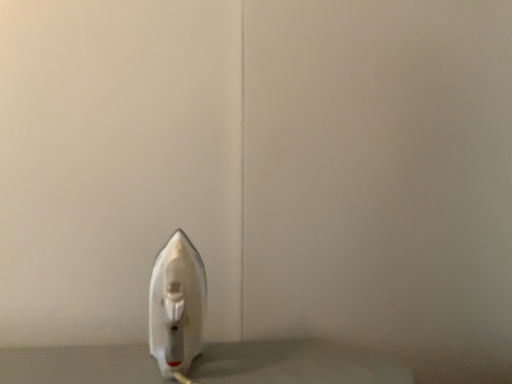
Locate an element on the screen. The image size is (512, 384). white plastic iron at center is located at coordinates (177, 307).

What do you see at coordinates (177, 307) in the screenshot? I see `white plastic iron at center` at bounding box center [177, 307].

Looking at this image, measure the distance between white plastic iron at center and camera.

white plastic iron at center and camera are 30.43 inches apart.

Image resolution: width=512 pixels, height=384 pixels. Identify the location of white plastic iron at center. pyautogui.click(x=177, y=307).